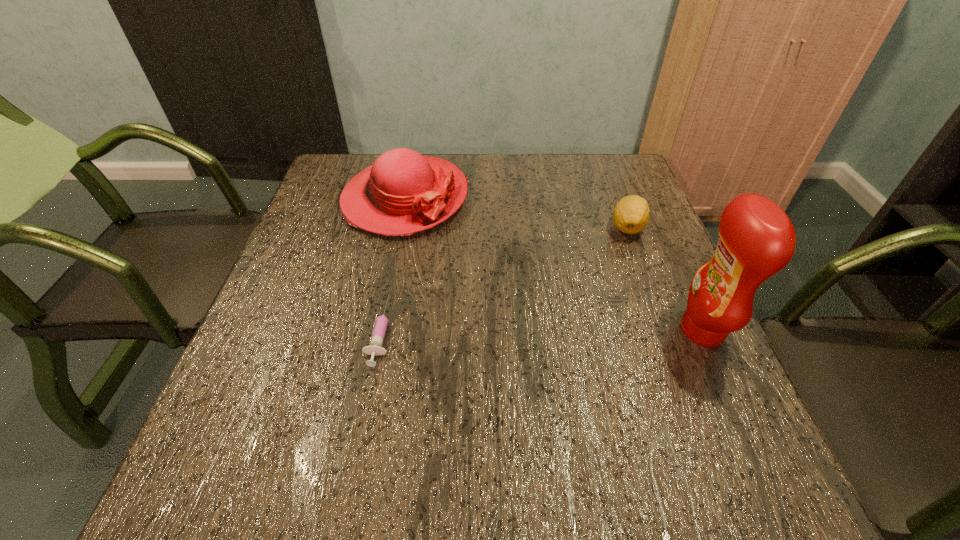
Locate an element on the screen. The width and height of the screenshot is (960, 540). blank space located 0.070m at the front of the second tallest object with a bow is located at coordinates (444, 251).

Where is `vacant space located 0.200m at the stem end of the lemon`? This screenshot has width=960, height=540. vacant space located 0.200m at the stem end of the lemon is located at coordinates (577, 283).

Find the location of a particular element. vacant space located 0.210m at the stem end of the lemon is located at coordinates (574, 285).

Find the location of `vacant space positioned 0.250m at the stem end of the lemon`. vacant space positioned 0.250m at the stem end of the lemon is located at coordinates (564, 295).

Where is `object that is at the far edge`? object that is at the far edge is located at coordinates (402, 193).

Find the location of `object situated at the left edge`. object situated at the left edge is located at coordinates (402, 193).

Find the location of a particular element. The width and height of the screenshot is (960, 540). condiment situated at the right edge is located at coordinates (756, 240).

Locate an element on the screen. The width and height of the screenshot is (960, 540). lemon that is positioned at the right edge is located at coordinates [x=631, y=214].

Locate an element on the screen. The height and width of the screenshot is (540, 960). object that is at the far left corner is located at coordinates (402, 193).

In order to click on free spot at the far edge of the desktop in this screenshot , I will do `click(498, 160)`.